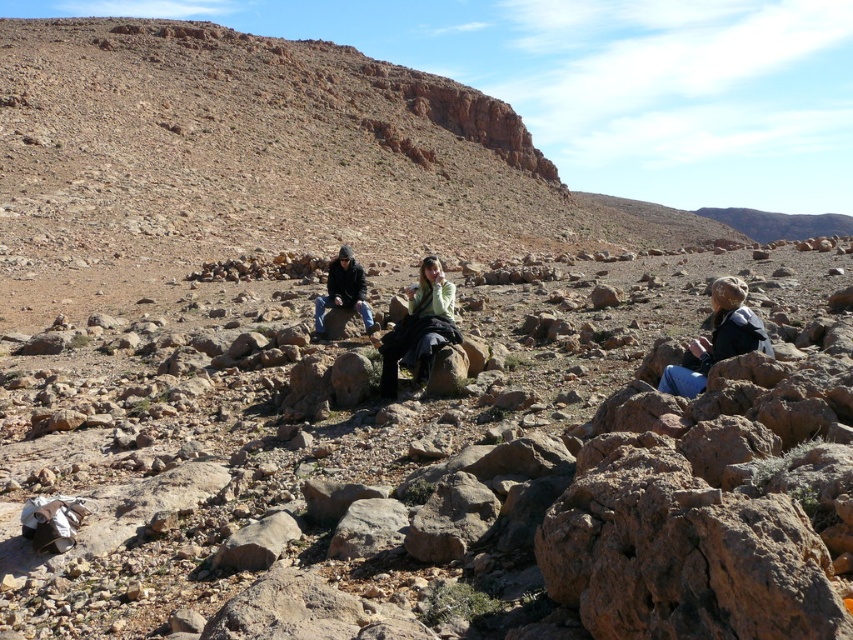
Which is in front, point (412, 304) or point (677, 381)?

Point (677, 381)

Who is lower down, light green sweater at center or blue denim jeans at lower right?

Positioned lower is light green sweater at center.

At what (x,y) coordinates should I click in order to perform the action: click on light green sweater at center. Please return your answer as a coordinate pair (x, y). This screenshot has height=640, width=853. Looking at the image, I should click on click(419, 330).

Find the location of a particular element. The height and width of the screenshot is (640, 853). light green sweater at center is located at coordinates (419, 330).

Based on the photo, does light green sweater at center appear under dark brown leather jacket at center?

Yes.

Who is more distant from viewer, (421, 285) or (318, 312)?

Point (318, 312)

Where is `light green sweater at center`? light green sweater at center is located at coordinates (419, 330).

Is point (706, 339) more distant than point (341, 298)?

That is False.

Is point (746, 339) closer to camera compared to point (347, 269)?

Yes, it is in front of point (347, 269).

Describe the element at coordinates (717, 339) in the screenshot. I see `blue denim jeans at lower right` at that location.

Where is `blue denim jeans at lower right`? The width and height of the screenshot is (853, 640). blue denim jeans at lower right is located at coordinates (717, 339).